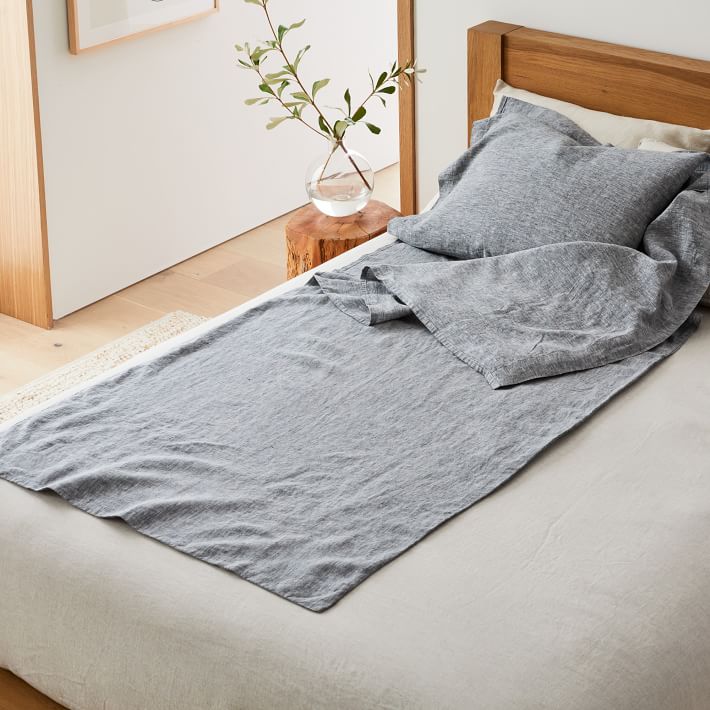
Identify the location of sheet. This screenshot has height=710, width=710. (395, 432), (500, 285), (402, 263), (681, 231), (676, 336), (364, 295).